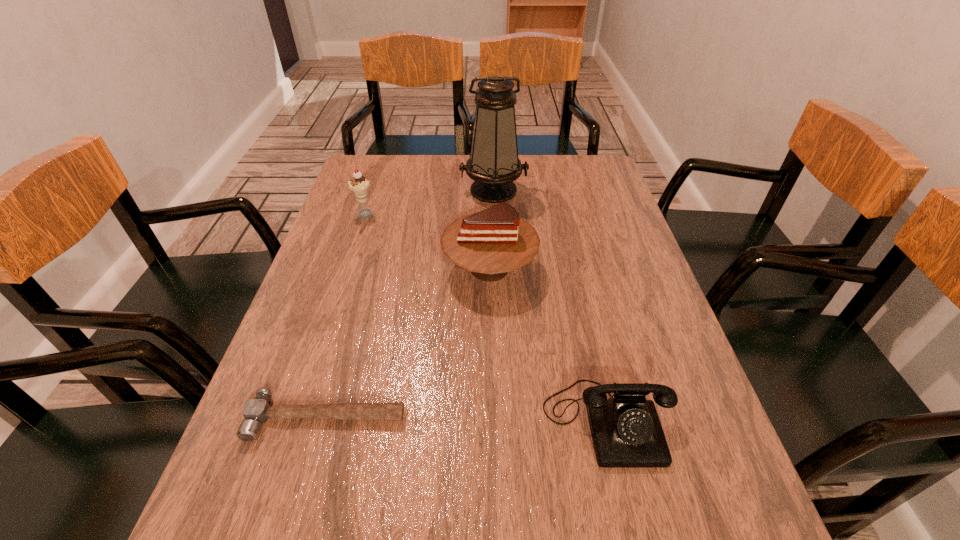
Identify the location of free space that is in between the hammer and the cake. This screenshot has width=960, height=540. (408, 343).

The height and width of the screenshot is (540, 960). Identify the location of vacant point located between the tallest object and the telephone. (550, 306).

At what (x,y) coordinates should I click in order to perform the action: click on free spot between the telephone and the farthest object. Please return your answer as a coordinate pair (x, y). The height and width of the screenshot is (540, 960). Looking at the image, I should click on (550, 306).

The height and width of the screenshot is (540, 960). In order to click on vacant space that's between the tallest object and the fourth nearest object in this screenshot , I will do `click(429, 203)`.

This screenshot has height=540, width=960. Find the location of `vacant point located between the farthest object and the icecream`. vacant point located between the farthest object and the icecream is located at coordinates (429, 203).

Locate an element on the screen. vacant region between the third nearest object and the shortest object is located at coordinates (408, 343).

Locate an element on the screen. vacant space that's between the cake and the fourth nearest object is located at coordinates (427, 242).

Where is `free point between the second shortest object and the farthest object`? free point between the second shortest object and the farthest object is located at coordinates (550, 306).

Where is `empty location between the hammer and the icecream`? empty location between the hammer and the icecream is located at coordinates (346, 316).

What are the coordinates of `free space between the icecream and the fourth tallest object` in the screenshot? It's located at (486, 318).